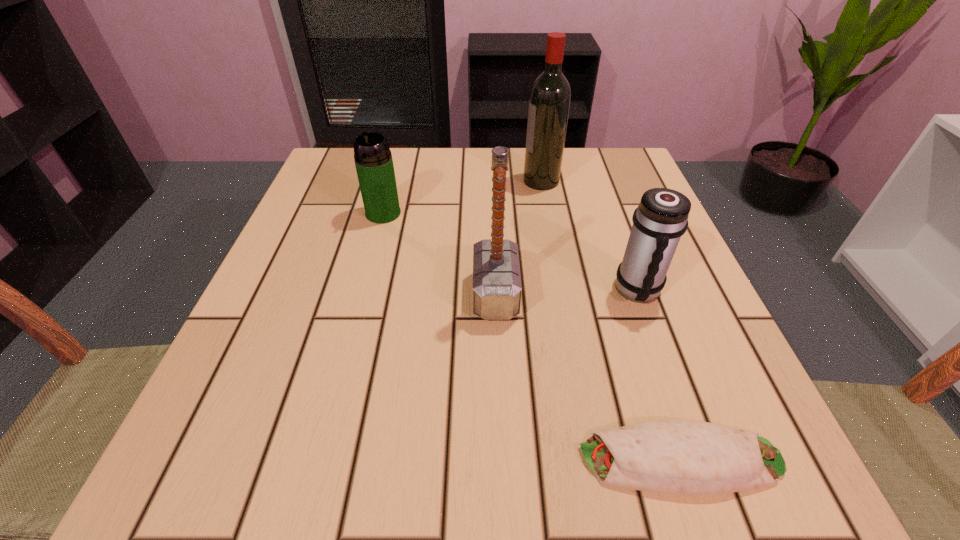
Find the location of a particular element. wine bottle is located at coordinates (549, 103).

Find the location of a particular element. The image size is (960, 540). the second object from left to right is located at coordinates (497, 288).

Find the location of a particular element. the second farthest object is located at coordinates (373, 159).

What are the coordinates of `the leftmost object` in the screenshot? It's located at (373, 159).

Identify the location of the nearer thermos bottle. The image size is (960, 540). (661, 218).

Find the location of `the nearest object`. the nearest object is located at coordinates (667, 456).

Identify the location of burrito. Image resolution: width=960 pixels, height=540 pixels. (667, 456).

Where is `free location located 0.360m on the label of the wine bottle`? free location located 0.360m on the label of the wine bottle is located at coordinates (365, 181).

Where is `vacant position located on the label of the wine bottle`? The width and height of the screenshot is (960, 540). vacant position located on the label of the wine bottle is located at coordinates (373, 181).

Locate an element on the screen. vacant space positioned on the label of the wine bottle is located at coordinates (501, 181).